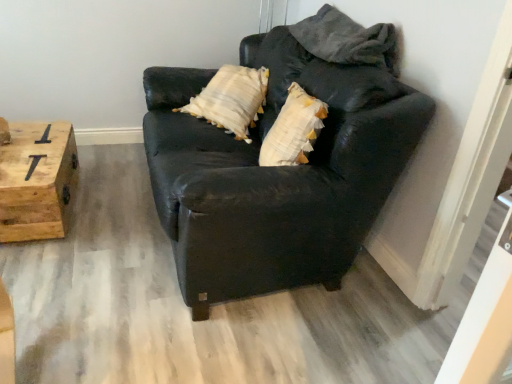
What do you see at coordinates (276, 174) in the screenshot? I see `matte black couch at center` at bounding box center [276, 174].

In order to face matte black couch at center, should I rotate leftwards or rightwards?

You should rotate left by 0.726 degrees.

Find the location of a particular element. matte black couch at center is located at coordinates (276, 174).

Identify the location of wooden crate at left. (37, 181).

The height and width of the screenshot is (384, 512). Describe the element at coordinates (37, 181) in the screenshot. I see `wooden crate at left` at that location.

Where is `matte black couch at center`? This screenshot has width=512, height=384. matte black couch at center is located at coordinates (276, 174).

Would you say matte black couch at center is to the left or to the right of wooden crate at left in the picture?

From the image, it's evident that matte black couch at center is to the right of wooden crate at left.

Does matte black couch at center come in front of wooden crate at left?

Yes.

Is point (335, 220) farther from camera compared to point (40, 144)?

No.

From the image's perspective, which is above, matte black couch at center or wooden crate at left?

matte black couch at center, from the image's perspective.

From a real-world perspective, who is located higher, matte black couch at center or wooden crate at left?

matte black couch at center.

Which of these two, matte black couch at center or wooden crate at left, is thinner?

Thinner between the two is wooden crate at left.

In the scene shown: Can you confirm if matte black couch at center is taller than wooden crate at left?

Indeed, matte black couch at center has a greater height compared to wooden crate at left.

Is matte black couch at center bigger or smaller than wooden crate at left?

In the image, matte black couch at center appears to be larger than wooden crate at left.

Is matte black couch at center completely or partially outside of wooden crate at left?

Yes, matte black couch at center is not within wooden crate at left.

Are matte black couch at center and wooden crate at left beside each other?

No, matte black couch at center is not with wooden crate at left.

Could you tell me if matte black couch at center is turned towards wooden crate at left?

Yes, matte black couch at center faces towards wooden crate at left.

How many degrees apart are the facing directions of matte black couch at center and wooden crate at left?

matte black couch at center and wooden crate at left are facing 87.4 degrees away from each other.

Image resolution: width=512 pixels, height=384 pixels. I want to click on table lying below the matte black couch at center (from the image's perspective), so click(37, 181).

Considering the positions of objects wooden crate at left and matte black couch at center in the image provided, who is more to the right, wooden crate at left or matte black couch at center?

matte black couch at center.

Consider the image. Considering the relative positions of wooden crate at left and matte black couch at center in the image provided, is wooden crate at left in front of matte black couch at center?

No, wooden crate at left is further to the viewer.

Does point (37, 125) lie behind point (183, 241)?

Yes, it is behind point (183, 241).

From the image's perspective, is wooden crate at left above or below matte black couch at center?

Based on their image positions, wooden crate at left is located beneath matte black couch at center.

From a real-world perspective, which object stands above the other?

matte black couch at center, from a real-world perspective.

Considering the sizes of objects wooden crate at left and matte black couch at center in the image provided, who is thinner, wooden crate at left or matte black couch at center?

With smaller width is wooden crate at left.

Looking at this image, does wooden crate at left have a lesser height compared to matte black couch at center?

Indeed, wooden crate at left has a lesser height compared to matte black couch at center.

Between wooden crate at left and matte black couch at center, which one has smaller size?

wooden crate at left is smaller.

Is matte black couch at center located within wooden crate at left?

No, matte black couch at center is located outside of wooden crate at left.

Is wooden crate at left not near matte black couch at center?

No, there isn't a large distance between wooden crate at left and matte black couch at center.

Looking at this image, is wooden crate at left oriented away from matte black couch at center?

No.

Measure the distance from wooden crate at left to matte black couch at center.

34.76 inches.

Where is `studio couch to the right of wooden crate at left`? The width and height of the screenshot is (512, 384). studio couch to the right of wooden crate at left is located at coordinates (276, 174).

Identify the location of studio couch above the wooden crate at left (from a real-world perspective). This screenshot has height=384, width=512. (276, 174).

At what (x,y) coordinates should I click in order to perform the action: click on studio couch lying on the right of wooden crate at left. Please return your answer as a coordinate pair (x, y). The height and width of the screenshot is (384, 512). Looking at the image, I should click on (276, 174).